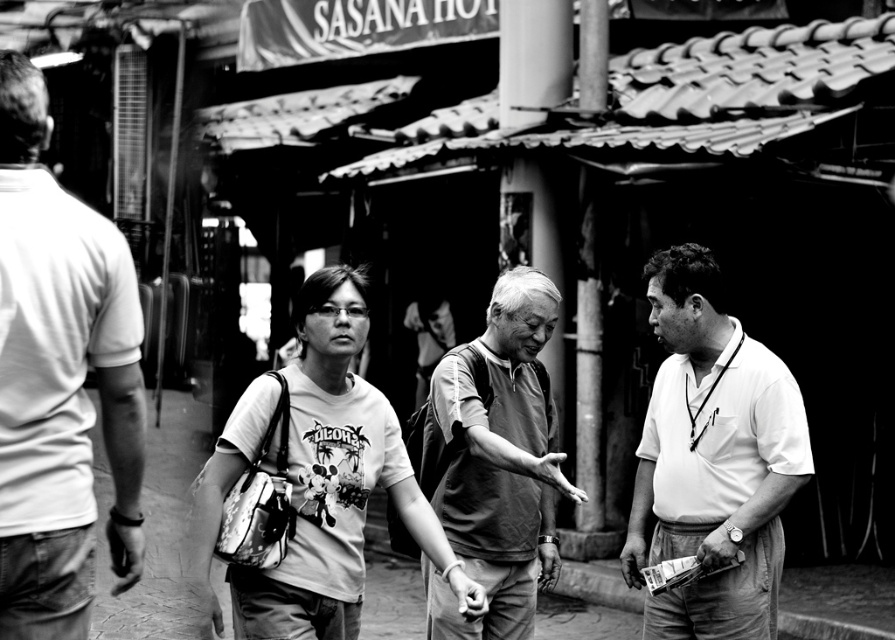
Does white cotton shirt at right appear under white cotton t-shirt at center?

No.

Between white cotton shirt at right and white cotton t-shirt at center, which one is positioned lower?

white cotton t-shirt at center is below.

You are a GUI agent. You are given a task and a screenshot of the screen. Output one action in this format:
    pyautogui.click(x=<x>, y=<y>)
    Task: Click on the white cotton shirt at right
    The image size is (895, 640).
    Given the screenshot: What is the action you would take?
    pyautogui.click(x=712, y=458)

Is white cotton shirt at left to the right of smooth concrete pavement at center from the viewer's perspective?

Yes, white cotton shirt at left is to the right of smooth concrete pavement at center.

Is white cotton shirt at left above smooth concrete pavement at center?

Yes.

Measure the distance between white cotton shirt at left and camera.

The distance of white cotton shirt at left from camera is 6.20 meters.

Where is `white cotton shirt at left`? This screenshot has height=640, width=895. white cotton shirt at left is located at coordinates (58, 380).

Does white cotton t-shirt at center have a lesser height compared to textured gray shirt at center?

Yes, white cotton t-shirt at center is shorter than textured gray shirt at center.

The image size is (895, 640). Describe the element at coordinates (337, 481) in the screenshot. I see `white cotton t-shirt at center` at that location.

You are a GUI agent. You are given a task and a screenshot of the screen. Output one action in this format:
    pyautogui.click(x=<x>, y=<y>)
    Task: Click on the white cotton t-shirt at center
    This screenshot has width=895, height=640.
    Given the screenshot: What is the action you would take?
    pyautogui.click(x=337, y=481)